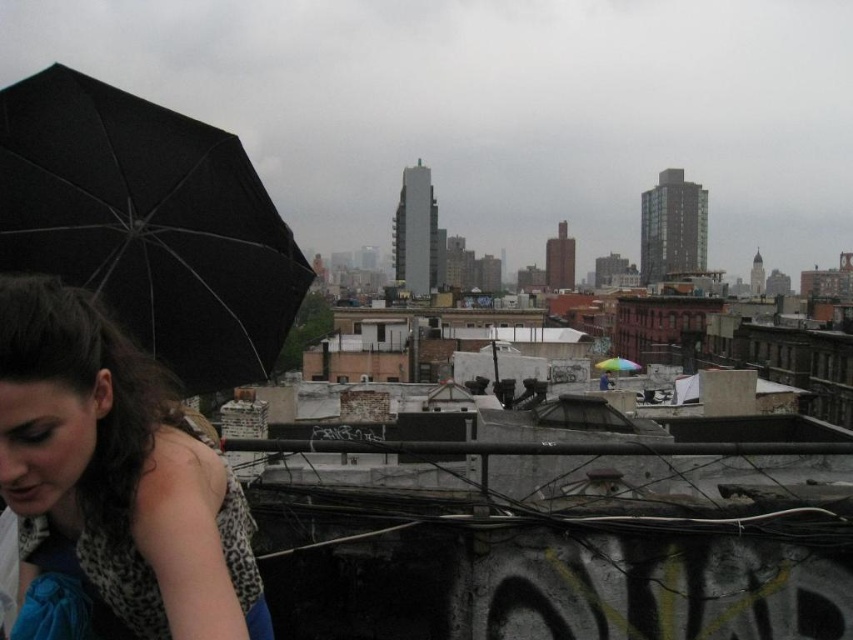
You are standing on the rooftop and want to place a new air conditioning unit. The unit requires a clear space of 1 meter in diameter. Given the current position of the black matte umbrella at left, can you determine if there is enough space to place the unit without overlapping the umbrella?

The black matte umbrella at left is located at point [148,225]. To determine if there is enough space, you need to ensure the new air conditioning unit is placed at least 0.5 meters away from the umbrella. If the required distance is maintained, the unit can be safely installed without overlapping.

You are a delivery drone operator. Your drone is currently hovering above the rooftop scene. You need to deliver a package to the black matte umbrella at left, but there is another matte black umbrella at left nearby. How far apart are these two umbrellas?

The distance between the black matte umbrella at left and the matte black umbrella at left is 8.29 meters.